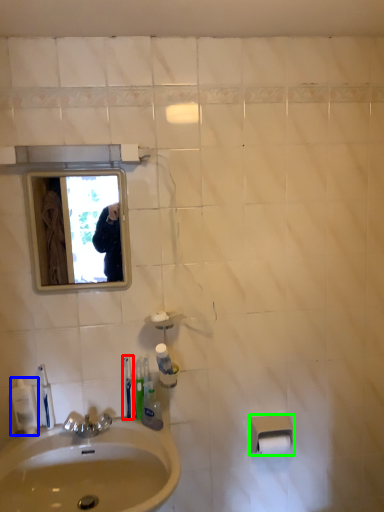
Question: Based on their relative distances, which object is farther from toothbrush (highlighted by a red box)? Choose from mouthwash (highlighted by a blue box) and toilet paper (highlighted by a green box).

Choices:
 (A) mouthwash
 (B) toilet paper

Answer: (B)